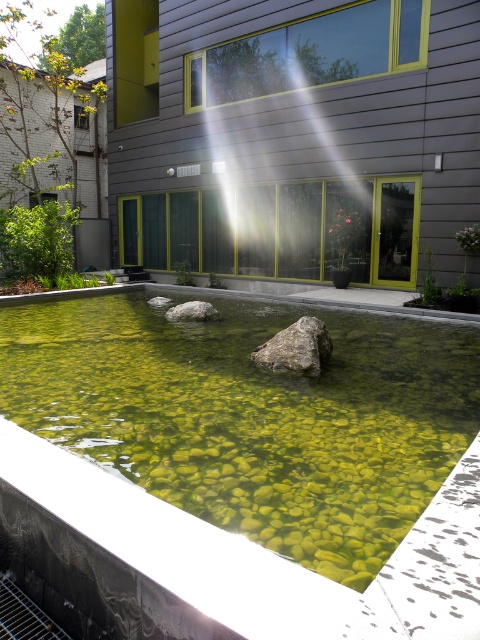
You are standing at the entrance of the building and want to locate the green pebbled pool at center. Based on the coordinates provided, in which direction should you walk to reach it?

The green pebbled pool at center is located at coordinates point (252, 417). Since you are at the entrance of the building, you should walk towards the center area to reach it.